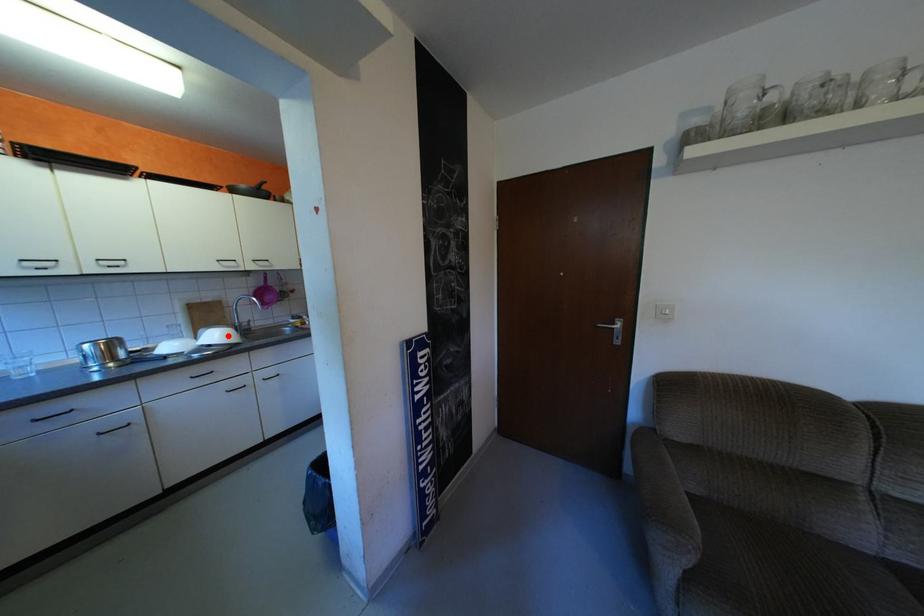
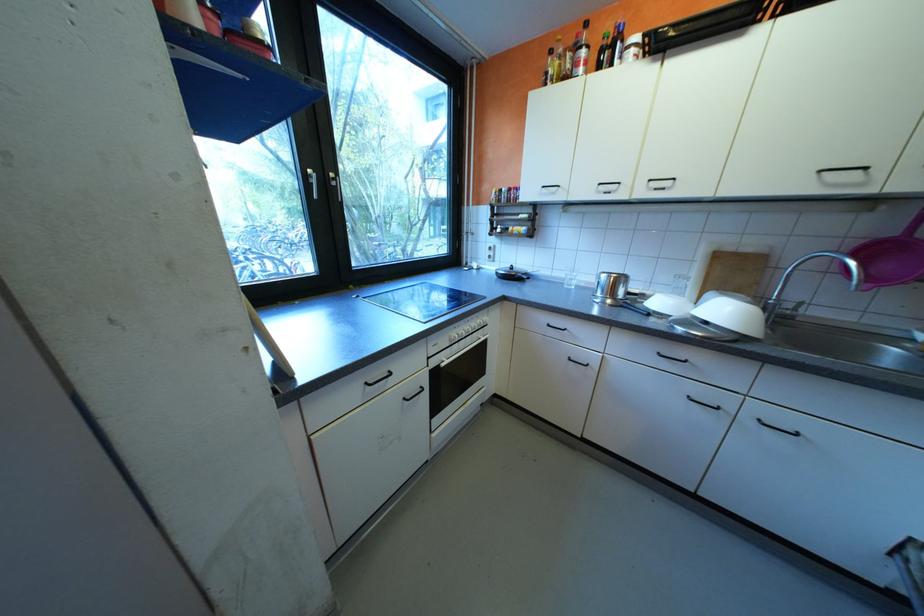
The point at the highlighted location is marked in the first image. Where is the corresponding point in the second image?

(736, 312)